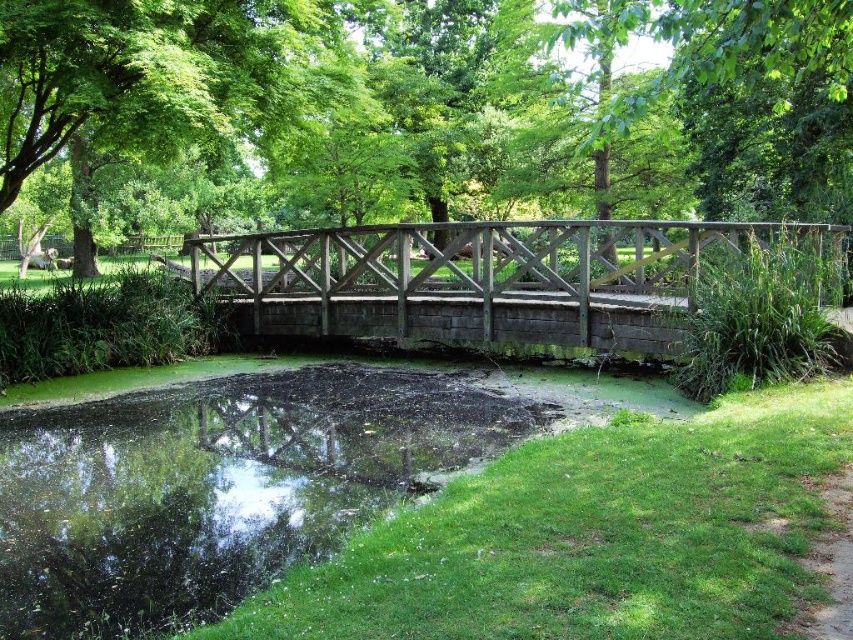
You are a park visitor who wants to cross the pond. You see two bridges in the scene, the green wood bridge at center and the wooden bridge at center. Which bridge should you choose to cross the pond?

The green wood bridge at center is larger in size than the wooden bridge at center, so you should choose the green wood bridge at center to cross the pond since it is bigger and more stable.

You are standing at the wooden bridge crossing over a small pond in the park. You see a point at coordinates point (1, 480). If you want to reach that point, which direction should you move relative to the bridge?

The point (1, 480) is 6.24 meters away from you, so you should move forward along the bridge towards the pond to reach it.

You are standing at the edge of the pond in the park scene. You see a point marked at coordinates (433, 106). What object is located at that point?

The point at coordinates (433, 106) marks the green wood bridge at center.